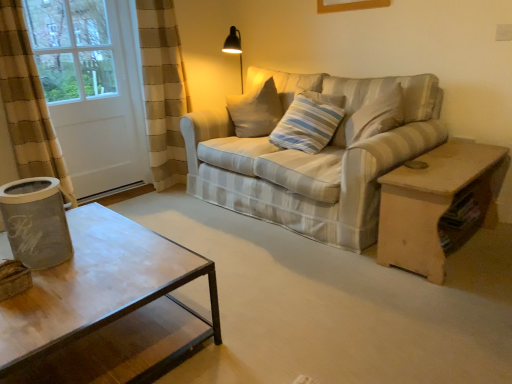
At what (x,y) coordinates should I click in order to perform the action: click on empty space that is ontop of light brown wooden table at right (from a real-world perspective). Please return your answer as a coordinate pair (x, y). This screenshot has height=384, width=512. Looking at the image, I should click on (458, 161).